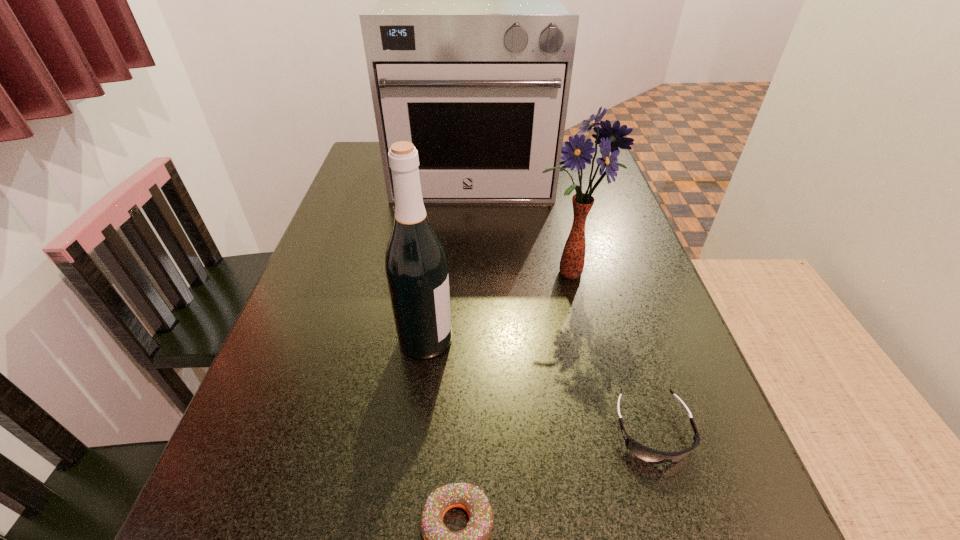
You are a GUI agent. You are given a task and a screenshot of the screen. Output one action in this format:
    pyautogui.click(x=<x>, y=<y>)
    Task: Click on the farthest object
    This screenshot has width=960, height=540.
    Given the screenshot: What is the action you would take?
    pyautogui.click(x=469, y=51)

Where is `wine bottle`? wine bottle is located at coordinates (416, 266).

The image size is (960, 540). In order to click on flower arrangement in this screenshot , I will do `click(576, 152)`.

Find the location of a particular element. The width and height of the screenshot is (960, 540). goggles is located at coordinates (645, 453).

Where is `vacant space situated 0.090m on the front panel of the farthest object`? The image size is (960, 540). vacant space situated 0.090m on the front panel of the farthest object is located at coordinates (x=471, y=228).

The height and width of the screenshot is (540, 960). I want to click on free location located on the label of the third farthest object, so click(x=661, y=340).

Locate an element on the screen. blank area located 0.200m on the front of the second farthest object is located at coordinates (589, 368).

Locate an element on the screen. This screenshot has height=540, width=960. vacant space positioned on the front and sides of the goggles is located at coordinates (678, 511).

Find the location of a particular element. This screenshot has height=540, width=960. object at the far edge is located at coordinates (469, 51).

Identify the location of object positioned at the left edge. This screenshot has width=960, height=540. (469, 51).